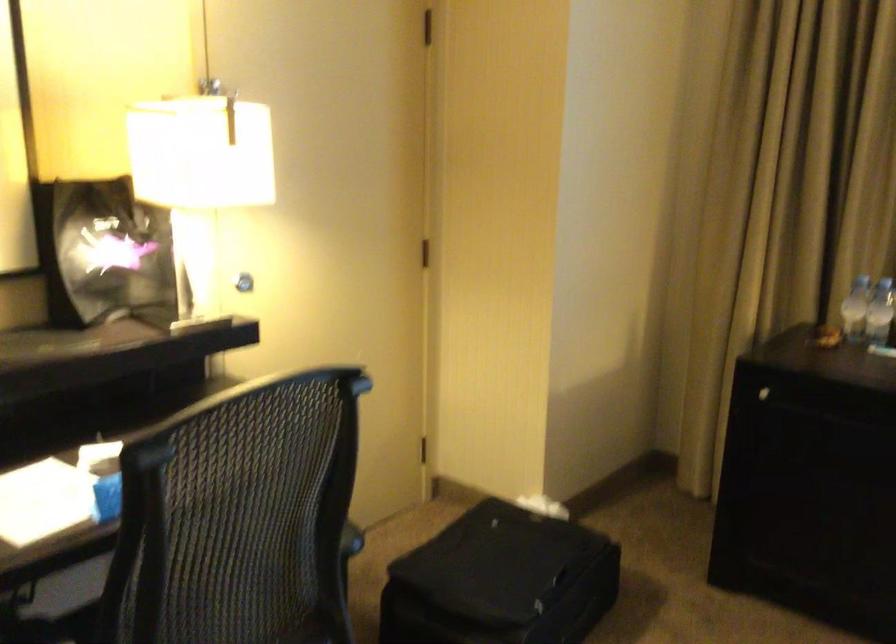
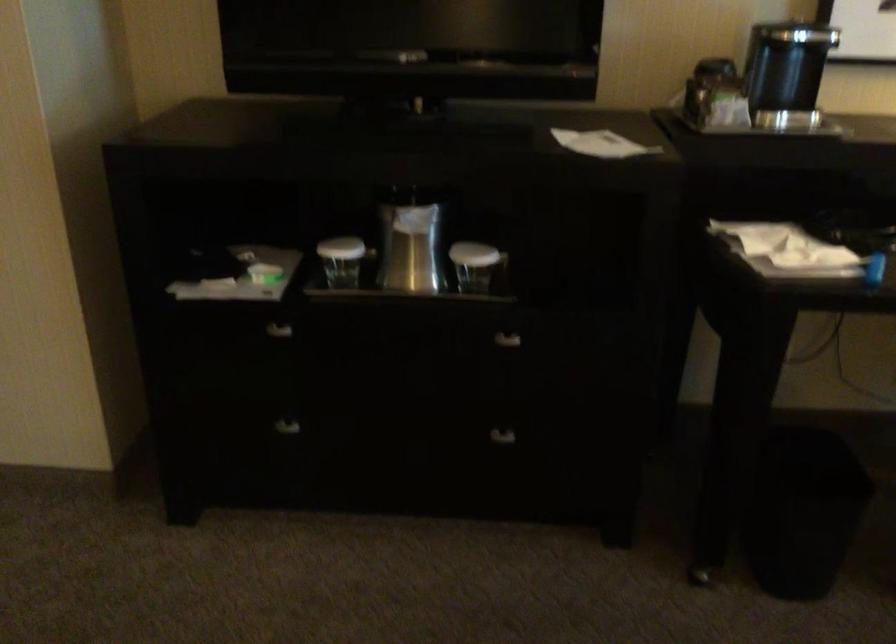
Question: The camera is either moving clockwise (left) or counter-clockwise (right) around the object. The first image is from the beginning of the video and the second image is from the end. Is the camera moving left or right when shooting the video?

Choices:
 (A) Left
 (B) Right

Answer: (B)